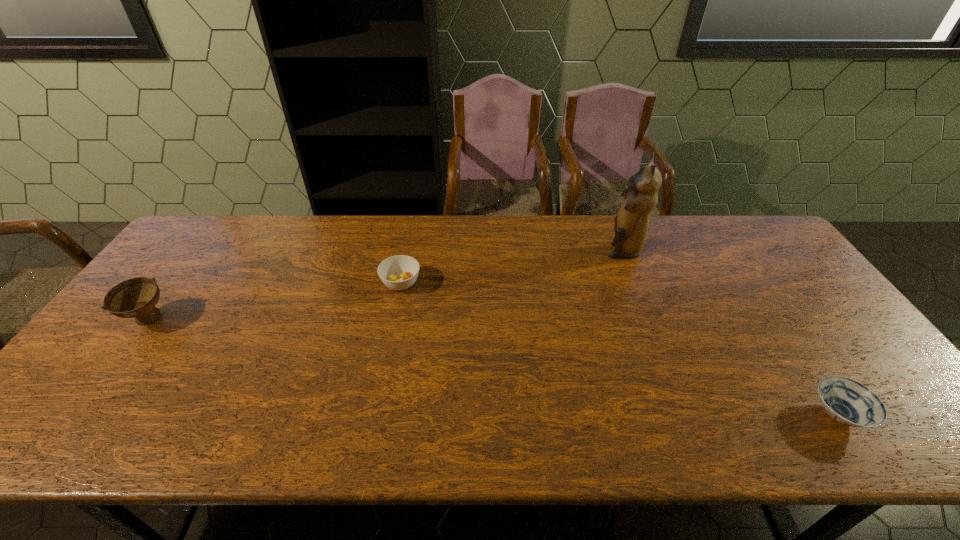
You are a GUI agent. You are given a task and a screenshot of the screen. Output one action in this format:
    pyautogui.click(x=<x>, y=<y>)
    Task: Click on the blank region between the nearest soup bowl and the leftmost soup bowl
    Image resolution: width=960 pixels, height=540 pixels.
    Given the screenshot: What is the action you would take?
    pyautogui.click(x=493, y=367)

Locate an element on the screen. This screenshot has width=960, height=540. free area in between the nearest soup bowl and the leftmost object is located at coordinates (493, 367).

Select which object appears as the closest to the second nearest soup bowl. Please provide its 2D coordinates. Your answer should be formatted as a tuple, i.e. [(x, y)], where the tuple contains the x and y coordinates of a point satisfying the conditions above.

[(400, 272)]

Select which object is the third closest to the second nearest soup bowl. Please provide its 2D coordinates. Your answer should be formatted as a tuple, i.e. [(x, y)], where the tuple contains the x and y coordinates of a point satisfying the conditions above.

[(849, 402)]

Identify which soup bowl is the third closest to the second object from right to left. Please provide its 2D coordinates. Your answer should be formatted as a tuple, i.e. [(x, y)], where the tuple contains the x and y coordinates of a point satisfying the conditions above.

[(137, 297)]

Locate an element on the screen. The height and width of the screenshot is (540, 960). the second closest soup bowl relative to the nearest object is located at coordinates (137, 297).

Locate an element on the screen. free point that satisfies the following two spatial constraints: 1. on the face of the rightmost object; 2. on the left side of the tallest object is located at coordinates [687, 415].

Find the location of a particular element. The width and height of the screenshot is (960, 540). vacant region that satisfies the following two spatial constraints: 1. on the face of the cat; 2. on the right side of the nearest soup bowl is located at coordinates (687, 415).

The height and width of the screenshot is (540, 960). I want to click on vacant space that satisfies the following two spatial constraints: 1. on the back side of the rightmost soup bowl; 2. on the face of the tallest object, so click(728, 249).

This screenshot has height=540, width=960. I want to click on vacant space that satisfies the following two spatial constraints: 1. on the face of the third object from left to right; 2. on the front side of the third object from right to left, so (636, 283).